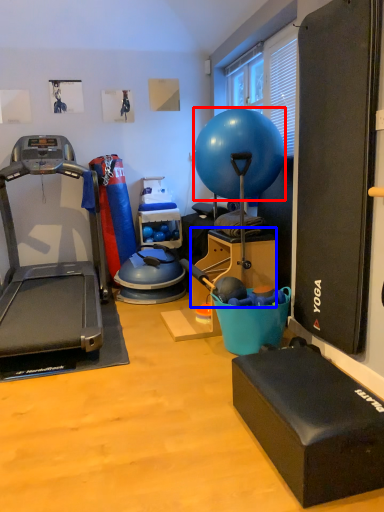
Question: Among these objects, which one is nearest to the camera, ball (highlighted by a red box) or box (highlighted by a blue box)?

Choices:
 (A) ball
 (B) box

Answer: (A)